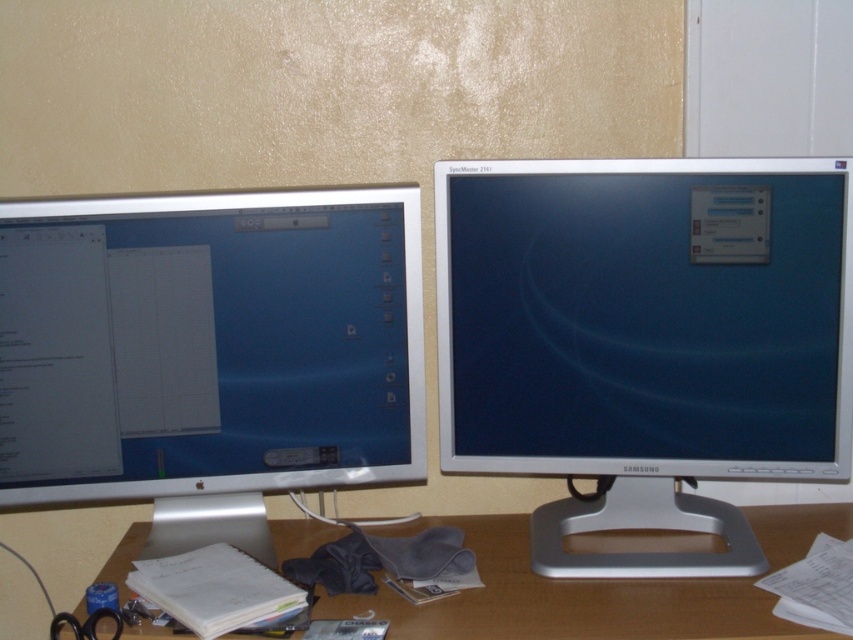
Find the location of `silver metallic monitor at right`. silver metallic monitor at right is located at coordinates (645, 339).

Is point (474, 467) positioned in front of point (645, 586)?

No, it is not.

Locate an element on the screen. Image resolution: width=853 pixels, height=640 pixels. silver metallic monitor at right is located at coordinates (645, 339).

Which of these two, silver metallic monitor at left or wooden desk at lower center, stands taller?

silver metallic monitor at left is taller.

The image size is (853, 640). What are the coordinates of `silver metallic monitor at left` in the screenshot? It's located at (209, 353).

Is point (753, 228) closer to camera compared to point (355, 412)?

Yes, point (753, 228) is in front of point (355, 412).

Does silver metallic monitor at right come in front of silver metallic monitor at left?

No, silver metallic monitor at right is behind silver metallic monitor at left.

This screenshot has height=640, width=853. What do you see at coordinates (645, 339) in the screenshot? I see `silver metallic monitor at right` at bounding box center [645, 339].

Where is `silver metallic monitor at right`? The width and height of the screenshot is (853, 640). silver metallic monitor at right is located at coordinates (645, 339).